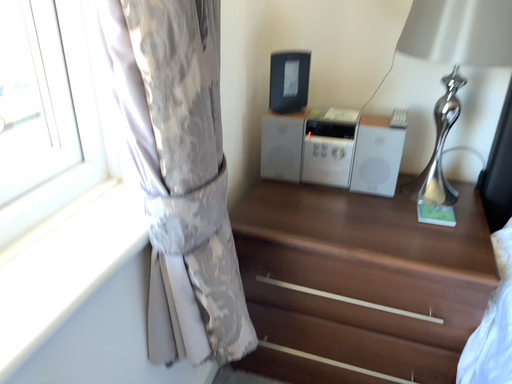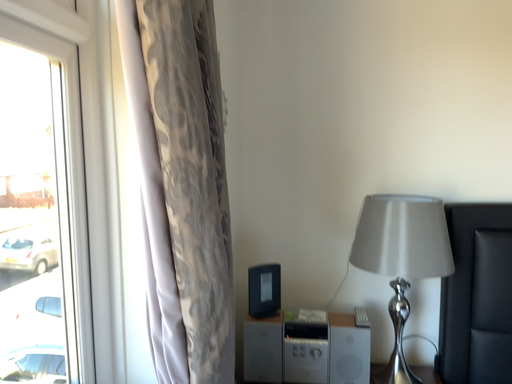
Question: Which way did the camera rotate in the video?

Choices:
 (A) rotated right
 (B) rotated left

Answer: (A)